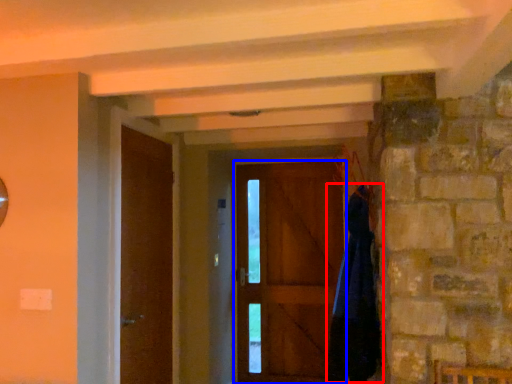
Question: Which object is closer to the camera taking this photo, cloak (highlighted by a red box) or door (highlighted by a blue box)?

Choices:
 (A) cloak
 (B) door

Answer: (A)